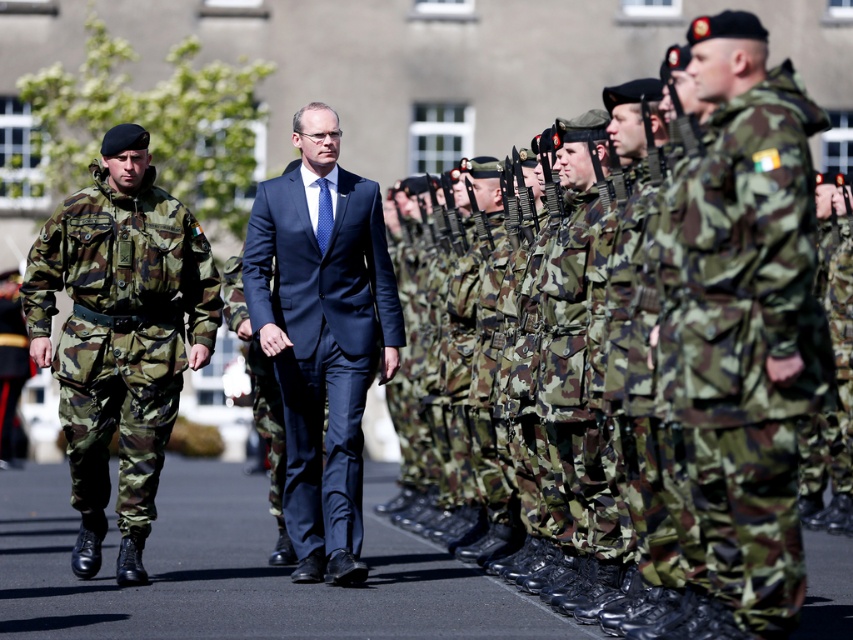
You are a photographer trying to capture the perfect shot of the camouflage fabric uniform at center. You need to position your camera exactly at point (x=747, y=324) to frame the subject properly. Is the camouflage fabric uniform at center positioned at this point?

Yes, the camouflage fabric uniform at center is located at point 0.909, 0.877.

You are a photographer at this military event. You need to capture a photo where both the camouflage fabric uniform at center and the navy blue suit at center are clearly visible. Given their sizes, which one should you focus on to ensure both are in frame without cropping?

The camouflage fabric uniform at center is smaller than the navy blue suit at center. To ensure both are in frame without cropping, focus on the larger navy blue suit at center while positioning the camera to include the smaller camouflage fabric uniform at center in the same shot.